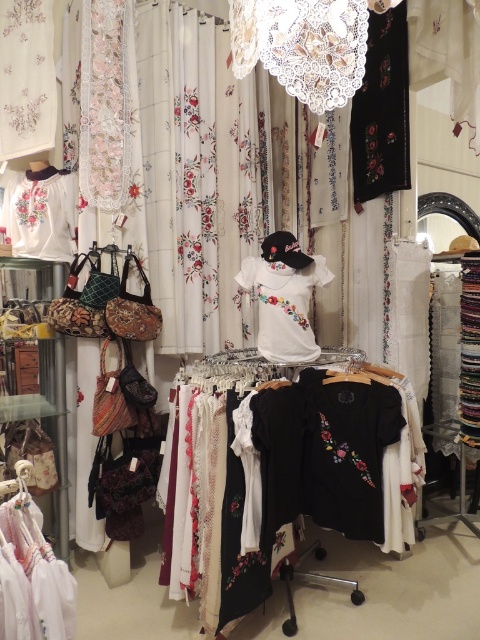
From the picture: You are a customer in the store and want to pick up both the black cotton shirts at center and the white embroidered blouse at upper left. Which item is higher up in the display?

The white embroidered blouse at upper left is higher up than the black cotton shirts at center, which are placed below it.

You are a customer in the store and want to take a photo of the black cotton shirts at center. The camera you have is 1.69 meters away from the shirts. Is the distance sufficient to capture a clear photo?

The black cotton shirts at center and camera are 1.69 meters apart, so the distance is sufficient to capture a clear photo as most cameras can focus at that distance.

What is located at the point with coordinates (292,476) in the image?

The point at coordinates (292,476) corresponds to black cotton shirts at center.